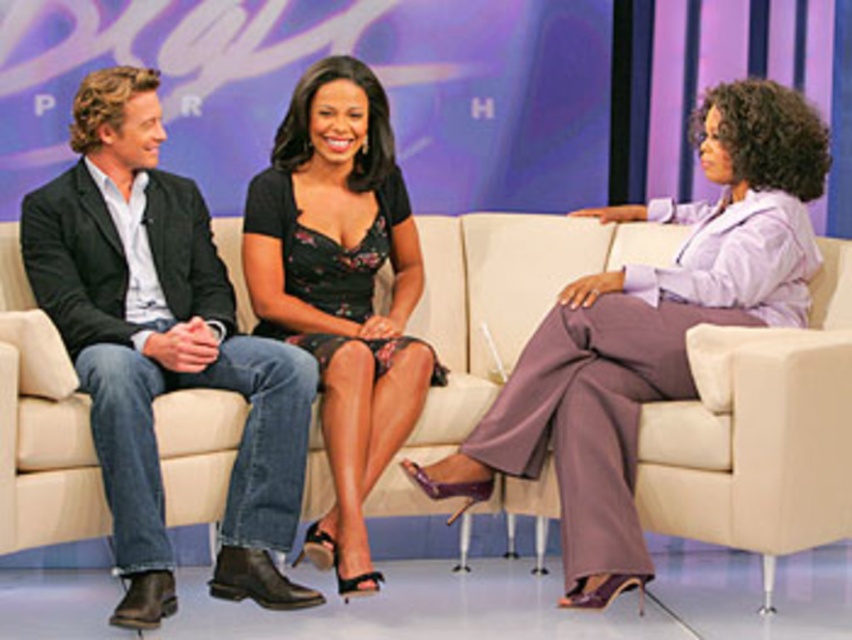
Question: Is beige fabric couch at center wider than black floral dress at center?

Choices:
 (A) yes
 (B) no

Answer: (A)

Question: Does beige fabric couch at center come in front of black floral dress at center?

Choices:
 (A) yes
 (B) no

Answer: (B)

Question: Among these points, which one is farthest from the camera?

Choices:
 (A) (735, 234)
 (B) (41, 284)
 (C) (499, 314)
 (D) (331, 528)

Answer: (C)

Question: Among these points, which one is farthest from the camera?

Choices:
 (A) (286, 376)
 (B) (588, 580)
 (C) (741, 540)

Answer: (A)

Question: Which object is positioned farthest from the denim jeans at left?

Choices:
 (A) purple satin pants at right
 (B) black floral dress at center
 (C) beige fabric couch at center

Answer: (A)

Question: Can you confirm if purple satin pants at right is thinner than black floral dress at center?

Choices:
 (A) no
 (B) yes

Answer: (A)